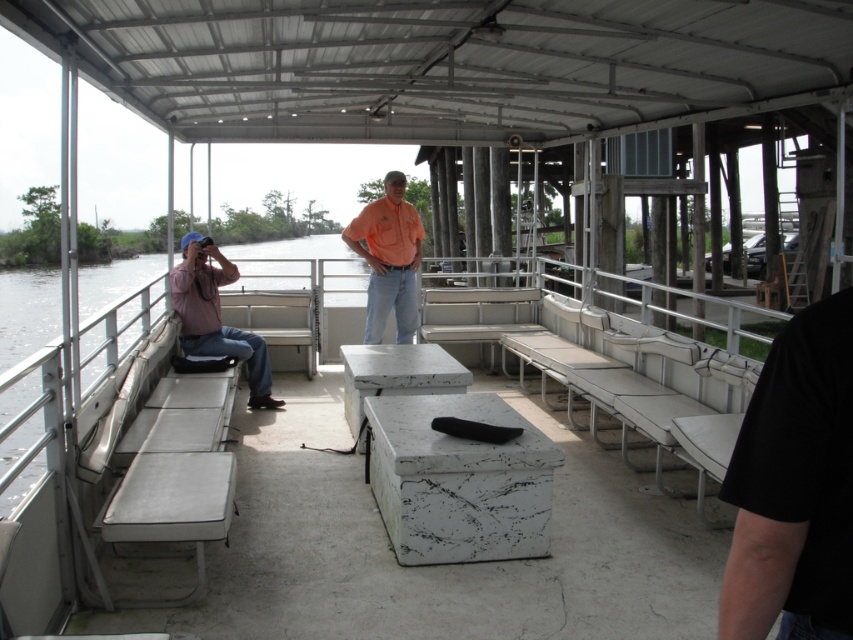
You are standing on the pontoon boat and want to place a 3 meter long banner between the white marble picnic table at center and the nearest bench. Is there enough space?

The white marble picnic table at center is 5.74 meters away from the viewer. However, the distance between the picnic table and the nearest bench is not provided, so it is impossible to determine if there is enough space for the 3 meter long banner.

You are standing on the pontoon boat deck and want to take a photo of the person in the orange shirt. Which object, the matte pink shirt at left or the white fabric bench at center, is closer to you when aiming your camera?

The matte pink shirt at left is closer to the viewer than the white fabric bench at center, so you should aim your camera towards the matte pink shirt at left to capture the orange shirt person more clearly.